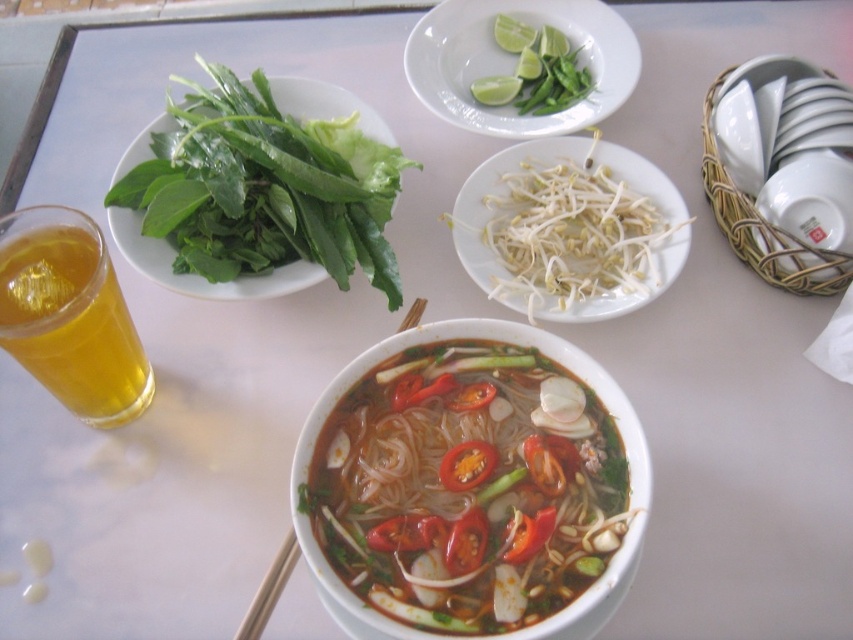
Between translucent glass cup at lower left and green leafy at upper center, which one has more height?

With more height is translucent glass cup at lower left.

Can you confirm if translucent glass cup at lower left is smaller than green leafy at upper center?

Incorrect, translucent glass cup at lower left is not smaller in size than green leafy at upper center.

Does point (82, 243) come in front of point (498, 36)?

That is True.

The height and width of the screenshot is (640, 853). I want to click on translucent glass cup at lower left, so click(70, 316).

The image size is (853, 640). What do you see at coordinates (262, 189) in the screenshot? I see `green leafy at upper left` at bounding box center [262, 189].

Can you confirm if green leafy at upper left is wider than green matte lime and bean sprouts at upper center?

Yes, green leafy at upper left is wider than green matte lime and bean sprouts at upper center.

Is point (178, 152) positioned before point (619, 72)?

Yes.

At what (x,y) coordinates should I click in order to perform the action: click on green leafy at upper left. Please return your answer as a coordinate pair (x, y). The height and width of the screenshot is (640, 853). Looking at the image, I should click on (262, 189).

Can you confirm if translucent glass noodles at center is positioned to the right of green leafy at upper center?

Incorrect, translucent glass noodles at center is not on the right side of green leafy at upper center.

Who is shorter, translucent glass noodles at center or green leafy at upper center?

Standing shorter between the two is green leafy at upper center.

Measure the distance between translucent glass noodles at center and camera.

translucent glass noodles at center is 15.49 inches away from camera.

The image size is (853, 640). I want to click on translucent glass noodles at center, so click(471, 486).